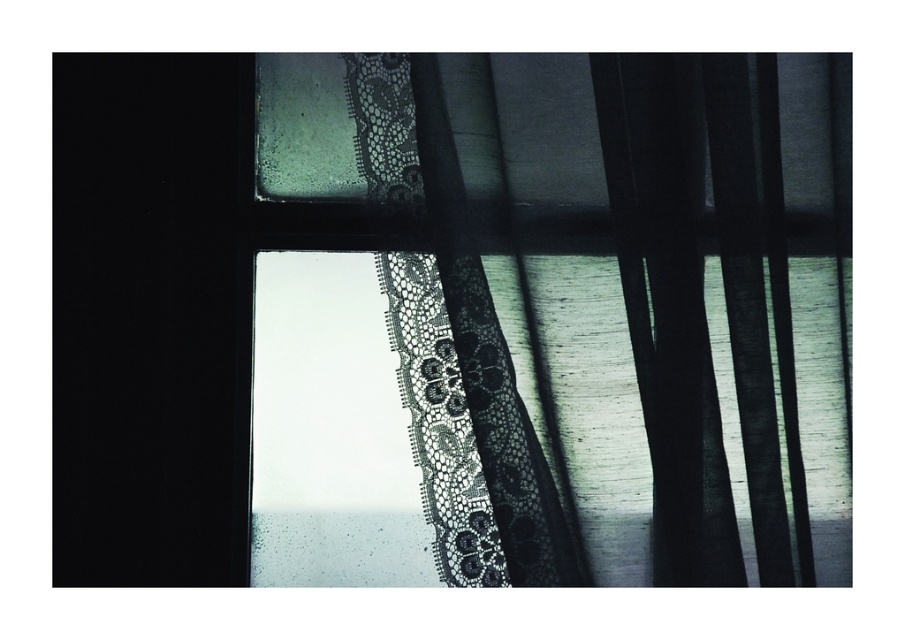
Question: Among these points, which one is farthest from the camera?

Choices:
 (A) (110, 236)
 (B) (814, 385)

Answer: (A)

Question: Which point is farther to the camera?

Choices:
 (A) (199, 99)
 (B) (742, 179)

Answer: (A)

Question: Can you confirm if black lace curtain at upper center is positioned to the left of black matte door at left?

Choices:
 (A) no
 (B) yes

Answer: (A)

Question: Can you confirm if black lace curtain at upper center is positioned below black matte door at left?

Choices:
 (A) yes
 (B) no

Answer: (A)

Question: Can you confirm if black lace curtain at upper center is positioned to the left of black matte door at left?

Choices:
 (A) no
 (B) yes

Answer: (A)